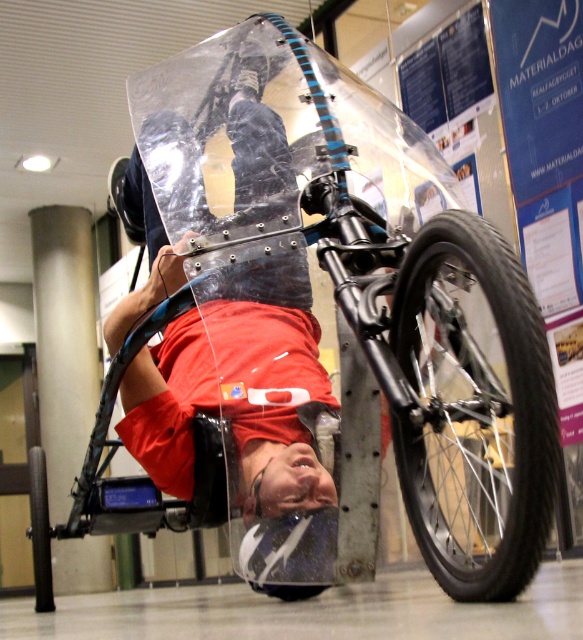
You are a researcher analyzing the structure of the bicycle frame in the image. You observe two points marked on the frame at coordinates point (x=447, y=572) and point (x=47, y=570). Based on their positions, which point is closer to the front part of the bicycle frame?

Point (x=447, y=572) is in front of point (x=47, y=570), so it is closer to the front part of the bicycle frame.

From the picture: You are standing in front of the bicycle frame and want to place a small sticker on the point that is closer to you. Which point should you choose between point (178, 216) and point (33, 556)?

Point (178, 216) is closer to the viewer than point (33, 556), so you should choose point (178, 216) to place the sticker.

You are a delivery robot with a 12 inch wide package. You need to move the package from the transparent plastic bicycle at center to the black rubber tire at lower right. Is there enough space to move the package through the path between them?

The distance between the transparent plastic bicycle at center and the black rubber tire at lower right is 19.15 inches. Since the package is 12 inches wide, there is sufficient space to move it through the path between them as 19.15 inches is greater than 12 inches.